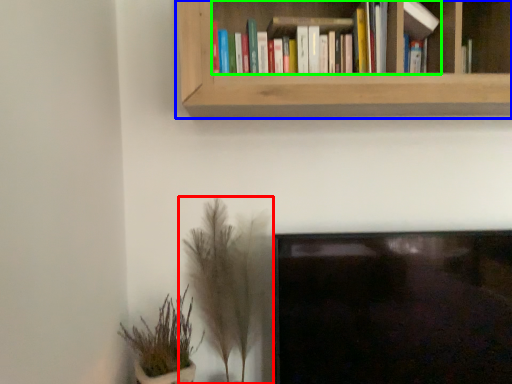
Question: Based on their relative distances, which object is farther from houseplant (highlighted by a red box)? Choose from bookcase (highlighted by a blue box) and book (highlighted by a green box).

Choices:
 (A) bookcase
 (B) book

Answer: (B)